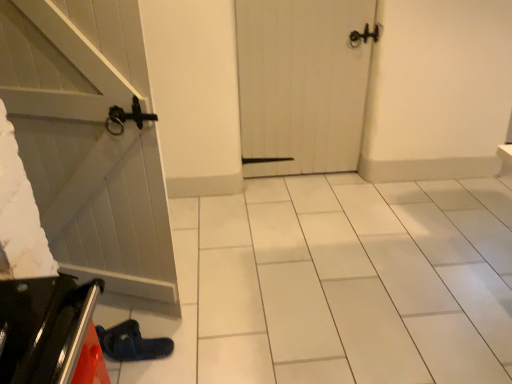
Question: Could white wooden door at center be considered to be inside shiny metallic oven at lower left?

Choices:
 (A) yes
 (B) no

Answer: (B)

Question: Is shiny metallic oven at lower left thinner than white wooden door at center?

Choices:
 (A) yes
 (B) no

Answer: (B)

Question: Is shiny metallic oven at lower left placed right next to white wooden door at center?

Choices:
 (A) no
 (B) yes

Answer: (A)

Question: Can you confirm if shiny metallic oven at lower left is bigger than white wooden door at center?

Choices:
 (A) yes
 (B) no

Answer: (B)

Question: Is shiny metallic oven at lower left closer to camera compared to white wooden door at center?

Choices:
 (A) no
 (B) yes

Answer: (B)

Question: Is shiny metallic oven at lower left further to camera compared to white wooden door at center?

Choices:
 (A) yes
 (B) no

Answer: (B)

Question: Can you confirm if blue suede slipper at lower left is thinner than shiny metallic oven at lower left?

Choices:
 (A) yes
 (B) no

Answer: (B)

Question: Could you tell me if blue suede slipper at lower left is facing shiny metallic oven at lower left?

Choices:
 (A) no
 (B) yes

Answer: (A)

Question: From a real-world perspective, is blue suede slipper at lower left located higher than shiny metallic oven at lower left?

Choices:
 (A) no
 (B) yes

Answer: (A)

Question: Can we say blue suede slipper at lower left lies outside shiny metallic oven at lower left?

Choices:
 (A) yes
 (B) no

Answer: (A)

Question: Can you confirm if blue suede slipper at lower left is shorter than shiny metallic oven at lower left?

Choices:
 (A) yes
 (B) no

Answer: (A)

Question: Is blue suede slipper at lower left surrounding shiny metallic oven at lower left?

Choices:
 (A) no
 (B) yes

Answer: (A)

Question: Is white wooden door at center at the left side of blue suede slipper at lower left?

Choices:
 (A) yes
 (B) no

Answer: (B)